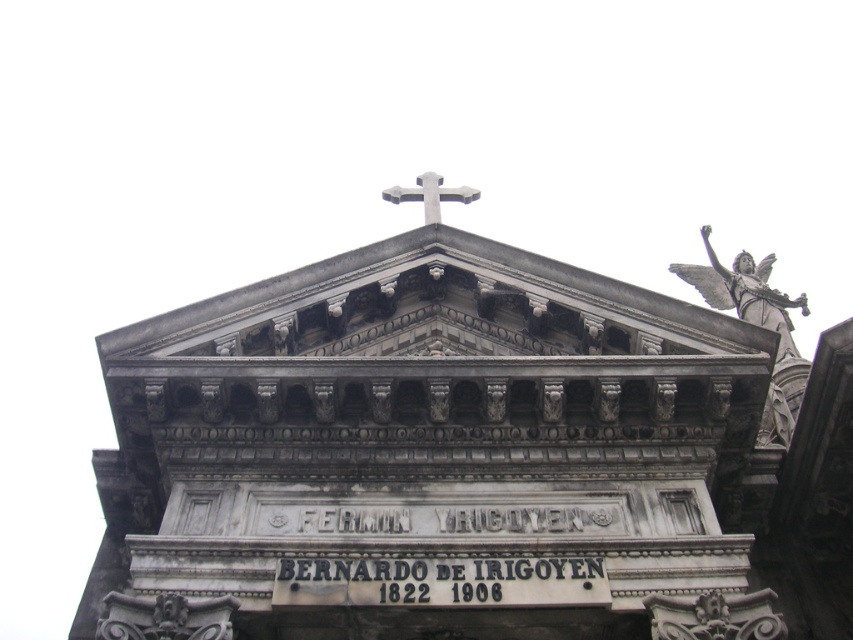
You are an architect analyzing the proportions of a mausoleum. You observe the gray stone church at center and the metallic cross at center. Which object has a greater width?

The gray stone church at center has a greater width than the metallic cross at center.

You are standing in front of the tomb and want to place a small bouquet of flowers between the gray stone church at center and the metallic cross at center. Based on their positions, which object should the bouquet be closer to?

The gray stone church at center is in front of the metallic cross at center, so the bouquet should be placed closer to the metallic cross at center to be between them.

Based on the scene of the mausoleum or tombstone with a gray stone church at center and a metallic cross at center, which object is taller?

The gray stone church at center is much taller than the metallic cross at center.